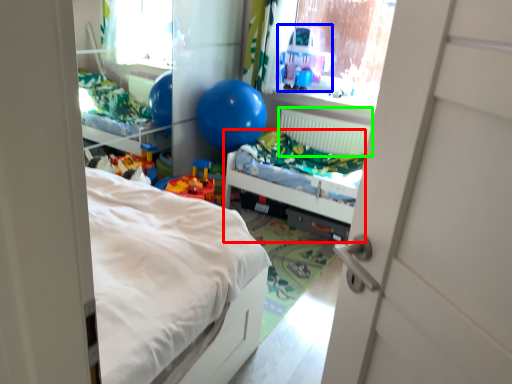
Question: Based on their relative distances, which object is nearer to hospital bed (highlighted by a red box)? Choose from toy (highlighted by a blue box) and radiator (highlighted by a green box).

Choices:
 (A) toy
 (B) radiator

Answer: (B)